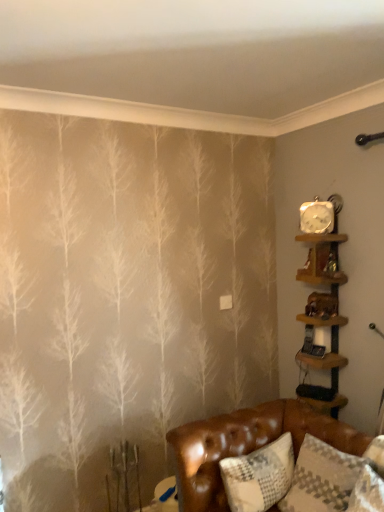
In order to face white textured pillow at lower right, should I rotate leftwards or rightwards?

It's best to rotate right around 20.954 degrees.

What is the approximate height of brown leather couch at lower right?

The height of brown leather couch at lower right is 17.12 inches.

Where is `wooden shelf at upper right, marked as the 2th shelf in a bottom-to-top arrangement`? wooden shelf at upper right, marked as the 2th shelf in a bottom-to-top arrangement is located at coordinates (320, 259).

Is wooden shelf at upper right, which is counted as the 1th shelf, starting from the top, a part of brown leather couch at lower right?

No, wooden shelf at upper right, which is counted as the 1th shelf, starting from the top, is not a part of brown leather couch at lower right.

Based on their sizes in the image, would you say brown leather couch at lower right is bigger or smaller than wooden shelf at upper right, which is counted as the 1th shelf, starting from the top?

In the image, brown leather couch at lower right appears to be larger than wooden shelf at upper right, which is counted as the 1th shelf, starting from the top.

From a real-world perspective, which object rests below the other?

brown leather couch at lower right, from a real-world perspective.

Which is correct: white textured pillow at lower right is inside wooden shelf at upper right, which is counted as the 1th shelf, starting from the top, or outside of it?

white textured pillow at lower right is not inside wooden shelf at upper right, which is counted as the 1th shelf, starting from the top, it's outside.

Between white textured pillow at lower right and wooden shelf at upper right, marked as the 2th shelf in a bottom-to-top arrangement, which one has more height?

white textured pillow at lower right is taller.

Is white textured pillow at lower right not close to wooden shelf at upper right, which is counted as the 1th shelf, starting from the top?

No.

The image size is (384, 512). I want to click on studio couch in front of the wooden shelf at upper right, which is counted as the 1th shelf, starting from the top, so click(247, 445).

Is wooden shelf at upper right, marked as the 2th shelf in a bottom-to-top arrangement, positioned with its back to brown leather couch at lower right?

No, wooden shelf at upper right, marked as the 2th shelf in a bottom-to-top arrangement, is not facing the opposite direction of brown leather couch at lower right.

Can you tell me how much wooden shelf at upper right, which is counted as the 1th shelf, starting from the top, and brown leather couch at lower right differ in facing direction?

93.9 degrees separate the facing orientations of wooden shelf at upper right, which is counted as the 1th shelf, starting from the top, and brown leather couch at lower right.

Is brown leather couch at lower right completely or partially inside wooden shelf at upper right, marked as the 2th shelf in a bottom-to-top arrangement?

No, brown leather couch at lower right is not surrounded by wooden shelf at upper right, marked as the 2th shelf in a bottom-to-top arrangement.

From a real-world perspective, is wooden shelf at right, acting as the second shelf starting from the top, physically located above or below metallic silver clock at upper right?

wooden shelf at right, acting as the second shelf starting from the top, is situated lower than metallic silver clock at upper right in the real world.

Which is closer to the camera, (x=326, y=246) or (x=313, y=206)?

Point (x=326, y=246) is closer to the camera than point (x=313, y=206).

Which object is positioned more to the right, wooden shelf at right, the 1th shelf in the bottom-to-top sequence, or metallic silver clock at upper right?

From the viewer's perspective, wooden shelf at right, the 1th shelf in the bottom-to-top sequence, appears more on the right side.

Which object is closer to the camera, wooden shelf at upper right, which is counted as the 1th shelf, starting from the top, or wooden shelf at right, the 1th shelf in the bottom-to-top sequence?

wooden shelf at upper right, which is counted as the 1th shelf, starting from the top.

Would you say wooden shelf at right, acting as the second shelf starting from the top, is part of wooden shelf at upper right, marked as the 2th shelf in a bottom-to-top arrangement,'s contents?

No, wooden shelf at right, acting as the second shelf starting from the top, is not surrounded by wooden shelf at upper right, marked as the 2th shelf in a bottom-to-top arrangement.

Would you consider wooden shelf at upper right, which is counted as the 1th shelf, starting from the top, to be distant from wooden shelf at right, the 1th shelf in the bottom-to-top sequence?

wooden shelf at upper right, which is counted as the 1th shelf, starting from the top, is actually quite close to wooden shelf at right, the 1th shelf in the bottom-to-top sequence.

Between metallic silver clock at upper right and wooden shelf at right, acting as the second shelf starting from the top, which one is positioned in front?

wooden shelf at right, acting as the second shelf starting from the top, is in front.

You are a GUI agent. You are given a task and a screenshot of the screen. Output one action in this format:
    pyautogui.click(x=<x>, y=<y>)
    Task: Click on the clock behind the wooden shelf at right, the 1th shelf in the bottom-to-top sequence
    
    Given the screenshot: What is the action you would take?
    pyautogui.click(x=317, y=217)

Can you confirm if metallic silver clock at upper right is bigger than wooden shelf at right, acting as the second shelf starting from the top?

Actually, metallic silver clock at upper right might be smaller than wooden shelf at right, acting as the second shelf starting from the top.

Is metallic silver clock at upper right situated inside wooden shelf at right, the 1th shelf in the bottom-to-top sequence, or outside?

metallic silver clock at upper right is not enclosed by wooden shelf at right, the 1th shelf in the bottom-to-top sequence.

In the scene shown: Considering the sizes of objects white textured pillow at lower right and wooden shelf at right, acting as the second shelf starting from the top, in the image provided, who is bigger, white textured pillow at lower right or wooden shelf at right, acting as the second shelf starting from the top,?

wooden shelf at right, acting as the second shelf starting from the top.

Which object is thinner, white textured pillow at lower right or wooden shelf at right, the 1th shelf in the bottom-to-top sequence?

Thinner between the two is wooden shelf at right, the 1th shelf in the bottom-to-top sequence.

Can you confirm if white textured pillow at lower right is taller than wooden shelf at right, the 1th shelf in the bottom-to-top sequence?

In fact, white textured pillow at lower right may be shorter than wooden shelf at right, the 1th shelf in the bottom-to-top sequence.

From the picture: Who is more distant, white textured pillow at lower right or wooden shelf at right, acting as the second shelf starting from the top?

wooden shelf at right, acting as the second shelf starting from the top, is more distant.

This screenshot has width=384, height=512. I want to click on the 1st shelf behind the brown leather couch at lower right, counting from the anchor's position, so click(320, 259).

Find the location of `shelf that is the 1st one when counting rightward from the white textured pillow at lower right`. shelf that is the 1st one when counting rightward from the white textured pillow at lower right is located at coordinates (320, 259).

Looking at the image, which one is located further to white textured pillow at lower right, wooden shelf at right, acting as the second shelf starting from the top, or brown leather couch at lower right?

wooden shelf at right, acting as the second shelf starting from the top.

Which object lies nearer to the anchor point wooden shelf at upper right, marked as the 2th shelf in a bottom-to-top arrangement, wooden shelf at right, the 1th shelf in the bottom-to-top sequence, or white textured pillow at lower right?

Among the two, wooden shelf at right, the 1th shelf in the bottom-to-top sequence, is located nearer to wooden shelf at upper right, marked as the 2th shelf in a bottom-to-top arrangement.

From the image, which object appears to be nearer to brown leather couch at lower right, white textured pillow at lower right or wooden shelf at upper right, marked as the 2th shelf in a bottom-to-top arrangement?

white textured pillow at lower right is positioned closer to the anchor brown leather couch at lower right.

When comparing their distances from brown leather couch at lower right, does metallic silver clock at upper right or white textured pillow at lower right seem closer?

white textured pillow at lower right is positioned closer to the anchor brown leather couch at lower right.

Considering their positions, is white textured pillow at lower right positioned closer to wooden shelf at upper right, which is counted as the 1th shelf, starting from the top, than metallic silver clock at upper right?

Among the two, metallic silver clock at upper right is located nearer to wooden shelf at upper right, which is counted as the 1th shelf, starting from the top.

Based on the photo, based on their spatial positions, is metallic silver clock at upper right or brown leather couch at lower right further from white textured pillow at lower right?

metallic silver clock at upper right lies further to white textured pillow at lower right than the other object.

Looking at the image, which one is located further to brown leather couch at lower right, wooden shelf at right, the 1th shelf in the bottom-to-top sequence, or wooden shelf at upper right, marked as the 2th shelf in a bottom-to-top arrangement?

wooden shelf at upper right, marked as the 2th shelf in a bottom-to-top arrangement, is further to brown leather couch at lower right.

Estimate the real-world distances between objects in this image. Which object is closer to wooden shelf at right, acting as the second shelf starting from the top, metallic silver clock at upper right or brown leather couch at lower right?

Based on the image, metallic silver clock at upper right appears to be nearer to wooden shelf at right, acting as the second shelf starting from the top.

Where is `shelf between white textured pillow at lower right and wooden shelf at right, acting as the second shelf starting from the top, along the z-axis`? shelf between white textured pillow at lower right and wooden shelf at right, acting as the second shelf starting from the top, along the z-axis is located at coordinates pos(320,259).

Locate an element on the screen. pillow between metallic silver clock at upper right and brown leather couch at lower right in the vertical direction is located at coordinates (x=332, y=481).

The width and height of the screenshot is (384, 512). What are the coordinates of `pillow between wooden shelf at upper right, which is counted as the 1th shelf, starting from the top, and brown leather couch at lower right in the up-down direction` in the screenshot? It's located at (332, 481).

The image size is (384, 512). Identify the location of studio couch located between white textured pillow at lower right and wooden shelf at right, acting as the second shelf starting from the top, in the depth direction. (247, 445).